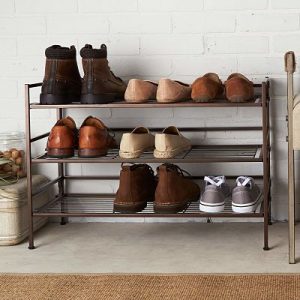
Locate an element on the screen. bottom shelf is located at coordinates (134, 190), (168, 190), (210, 195), (243, 192).